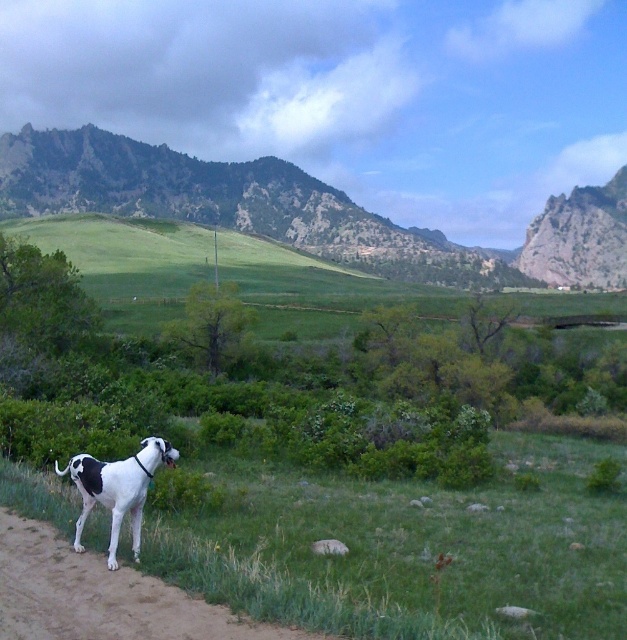
Is rugged brown mountain at upper left bigger than brown dirt track at lower left?

Correct, rugged brown mountain at upper left is larger in size than brown dirt track at lower left.

Is rugged brown mountain at upper left closer to camera compared to brown dirt track at lower left?

No.

Who is more distant from viewer, (307, 241) or (61, 540)?

The point (307, 241) is more distant.

You are a GUI agent. You are given a task and a screenshot of the screen. Output one action in this format:
    pyautogui.click(x=<x>, y=<y>)
    Task: Click on the rugged brown mountain at upper left
    Image resolution: width=627 pixels, height=640 pixels.
    Given the screenshot: What is the action you would take?
    [x=303, y=211]

Locate an element on the screen. This screenshot has height=640, width=627. brown dirt track at lower left is located at coordinates (102, 596).

Is brown dirt track at lower left shorter than white glossy dog at lower left?

Yes.

I want to click on brown dirt track at lower left, so click(102, 596).

Can you confirm if rugged brown mountain at upper left is thinner than white glossy dog at lower left?

Incorrect, rugged brown mountain at upper left's width is not less than white glossy dog at lower left's.

Can you confirm if rugged brown mountain at upper left is smaller than white glossy dog at lower left?

Incorrect, rugged brown mountain at upper left is not smaller in size than white glossy dog at lower left.

I want to click on rugged brown mountain at upper left, so click(x=303, y=211).

Find the location of a particular element. rugged brown mountain at upper left is located at coordinates (303, 211).